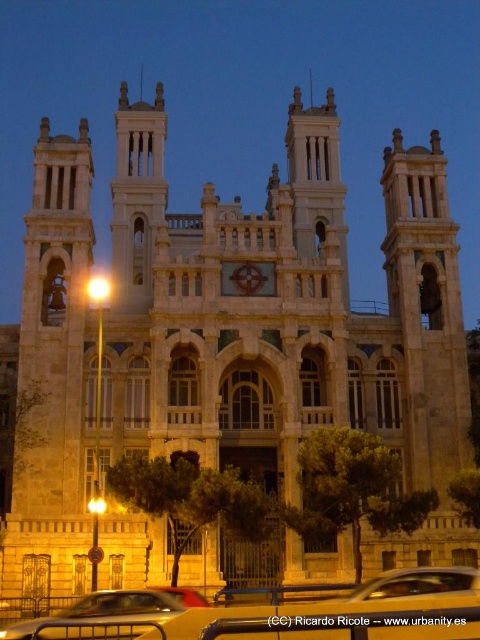
You are a photographer planning to take a photo of the grand historic building. You notice two metallic silver cars in the scene. The first is the metallic silver car at center, and the second is the metallic silver car at lower center. Since you want to focus on the building, which car should you avoid including in your shot to minimize distraction?

You should avoid including the metallic silver car at center because it is positioned over the metallic silver car at lower center, making it more prominent and potentially more distracting in the photo.